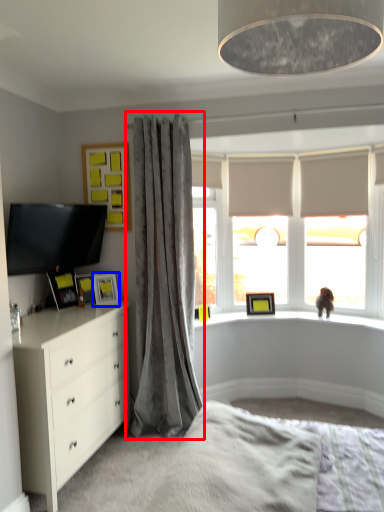
Question: Which object appears farthest to the camera in this image, curtain (highlighted by a red box) or picture frame (highlighted by a blue box)?

Choices:
 (A) curtain
 (B) picture frame

Answer: (B)